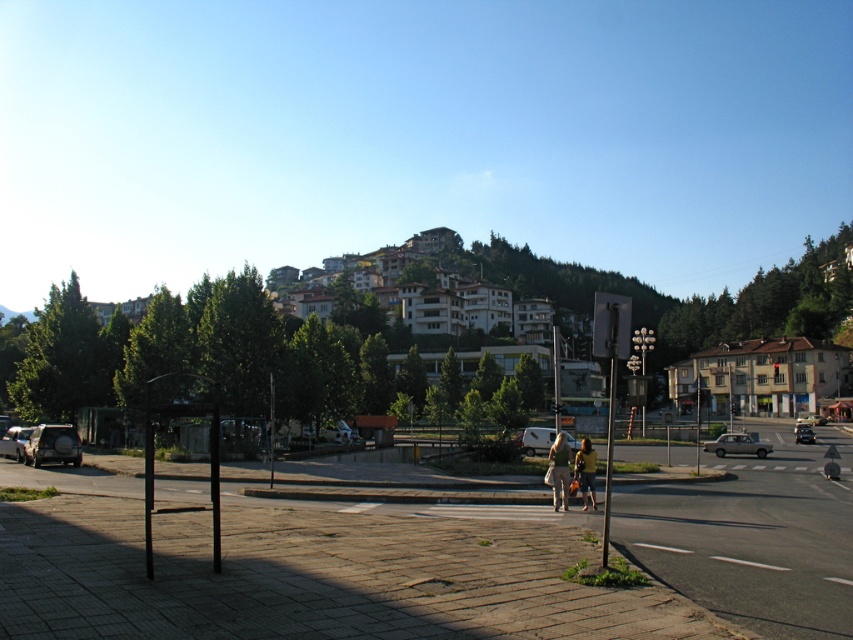
Question: Which point appears farthest from the camera in this image?

Choices:
 (A) (613, 342)
 (B) (48, 436)

Answer: (B)

Question: Where is metallic rectangular sign at right located in relation to metallic silver suv at left in the image?

Choices:
 (A) left
 (B) right

Answer: (B)

Question: Which point is closer to the camera?

Choices:
 (A) (798, 419)
 (B) (795, 429)
 (C) (20, 432)

Answer: (C)

Question: Which object is positioned closest to the red glass traffic light at upper center?

Choices:
 (A) green fabric bag at center
 (B) metallic silver truck at center
 (C) silver metallic van at center

Answer: (C)

Question: In this image, where is metallic rectangular sign at right located relative to metallic silver suv at left?

Choices:
 (A) below
 (B) above

Answer: (B)

Question: Does matte silver suv at lower left have a smaller size compared to metallic silver sedan at center?

Choices:
 (A) no
 (B) yes

Answer: (B)